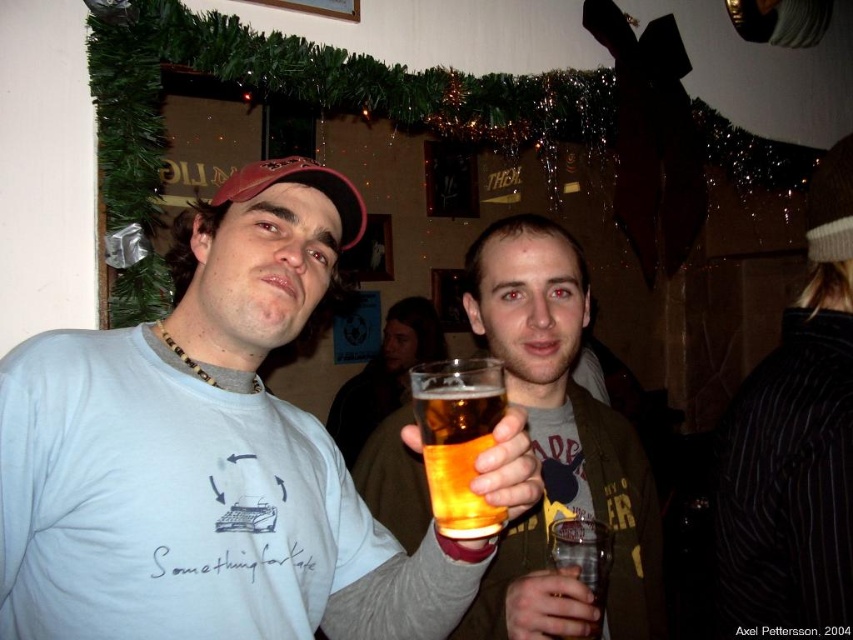
Question: Which object is positioned closest to the matte brown jacket at center?

Choices:
 (A) translucent glass mug at center
 (B) translucent plastic cup at center

Answer: (B)

Question: Which object is farther from the camera taking this photo?

Choices:
 (A) matte white t-shirt at center
 (B) translucent glass at center
 (C) translucent glass mug at center
 (D) matte brown jacket at center

Answer: (C)

Question: In this image, where is matte brown jacket at center located relative to translucent glass mug at center?

Choices:
 (A) below
 (B) above

Answer: (B)

Question: Does matte white t-shirt at center have a larger size compared to translucent glass mug at center?

Choices:
 (A) no
 (B) yes

Answer: (A)

Question: Does matte white t-shirt at center have a larger size compared to translucent plastic cup at center?

Choices:
 (A) no
 (B) yes

Answer: (B)

Question: Which of the following is the closest to the observer?

Choices:
 (A) pyautogui.click(x=413, y=540)
 (B) pyautogui.click(x=605, y=552)
 (C) pyautogui.click(x=496, y=456)

Answer: (C)